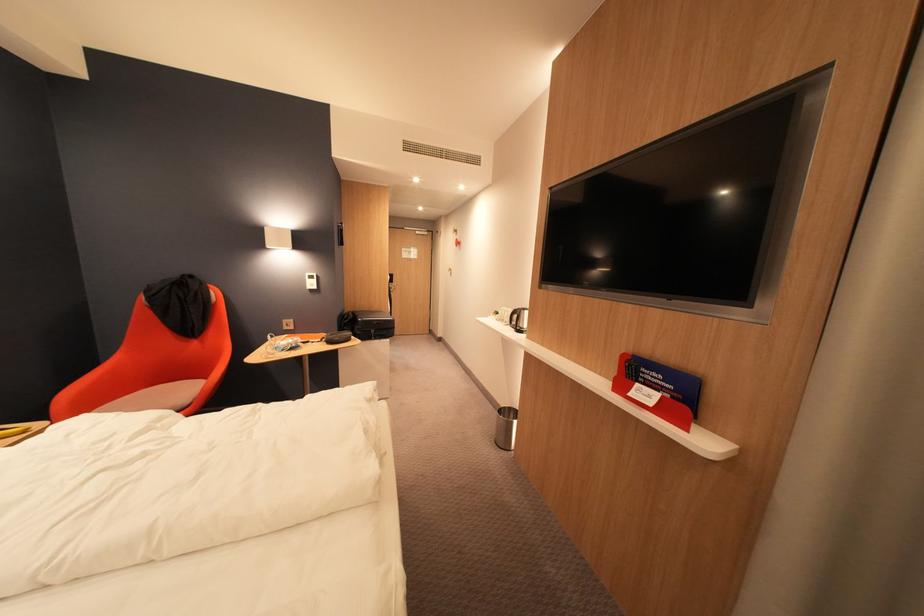
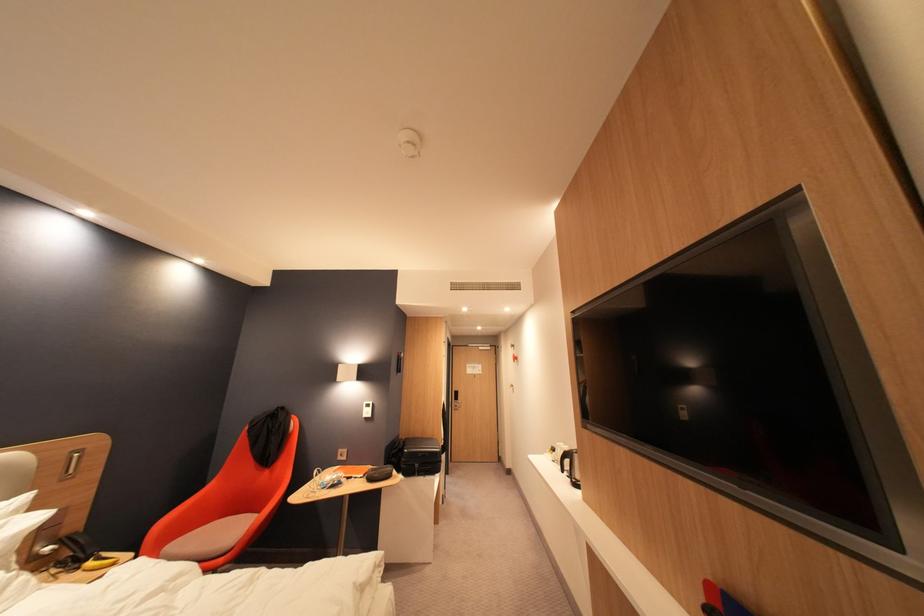
In the second image, find the point that corresponds to [329,342] in the first image.

(371, 477)